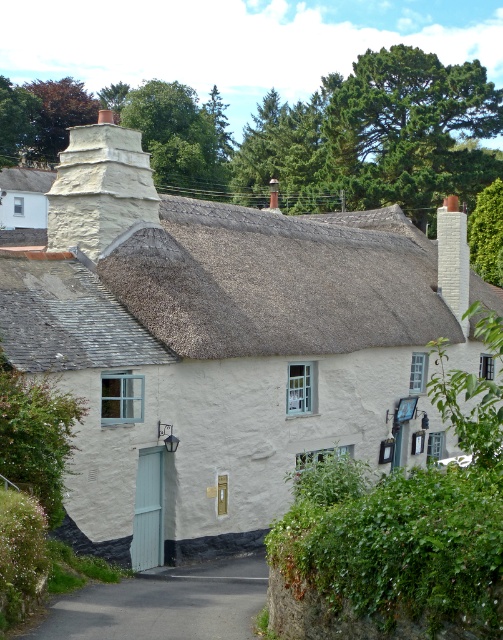
You are a delivery person approaching the thatched cottage. You need to determine the best path to deliver a package to the front door. Considering the thatched roof at upper center and the asphalt road at lower center, which object is larger in size and might help you identify the cottage from a distance?

The thatched roof at upper center is bigger than the asphalt road at lower center, so the thatched roof at upper center is larger and would be more visible from a distance, helping you identify the cottage.

You are standing in front of the thatched cottage and want to walk to the asphalt road at lower center. Which direction should you head from the white stone chimney at upper center?

The asphalt road at lower center is to the right of the white stone chimney at upper center, so you should head to the right from the white stone chimney at upper center to reach the asphalt road at lower center.

You are standing at the front of the thatched cottage and want to take a photo of the asphalt road at lower center. Where should you point your camera to capture it?

You should point your camera towards the lower center area at coordinates approximately 0.945 on the x axis and 0.326 on the y axis to capture the asphalt road at lower center.